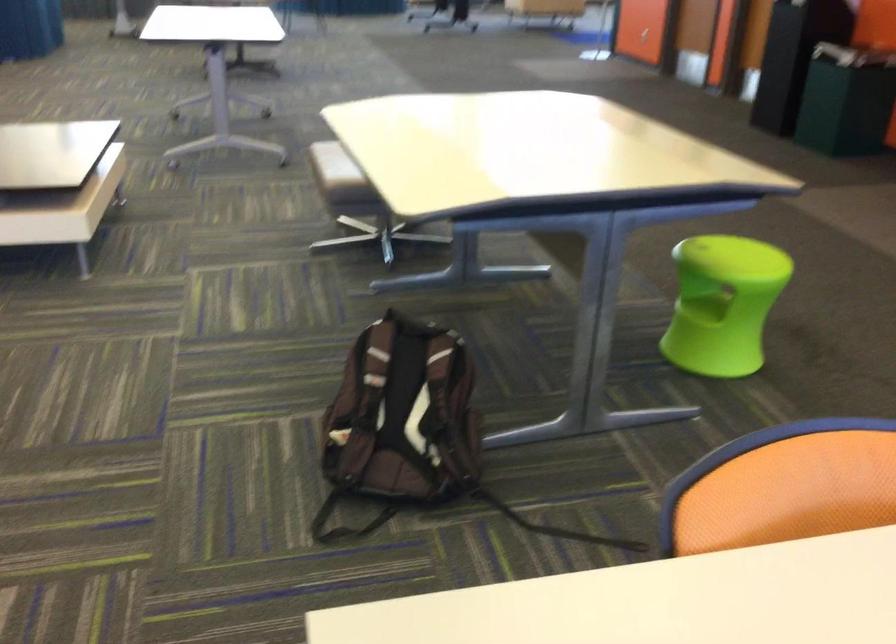
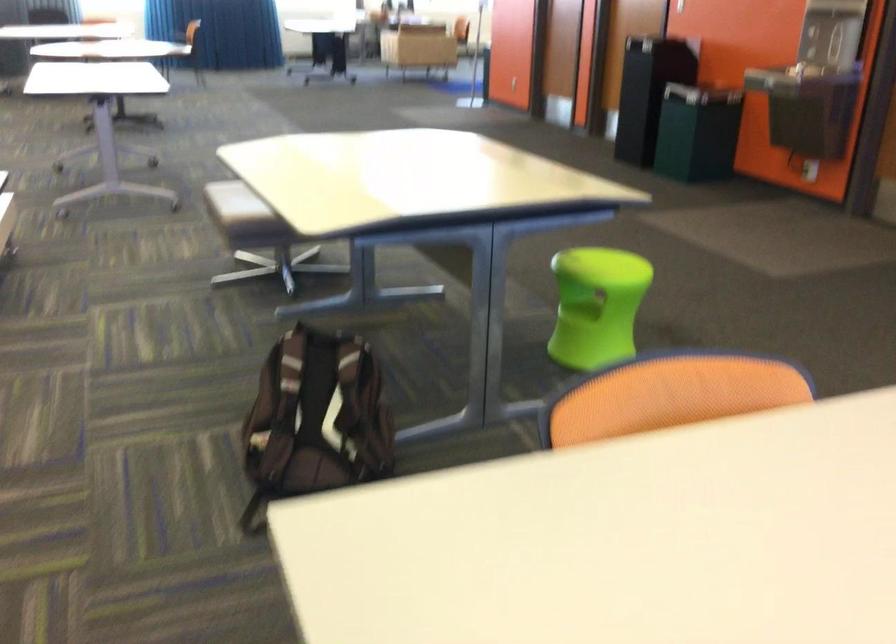
Question: The images are taken continuously from a first-person perspective. In which direction is your viewpoint rotating?

Choices:
 (A) Left
 (B) Right
 (C) Up
 (D) Down

Answer: (B)